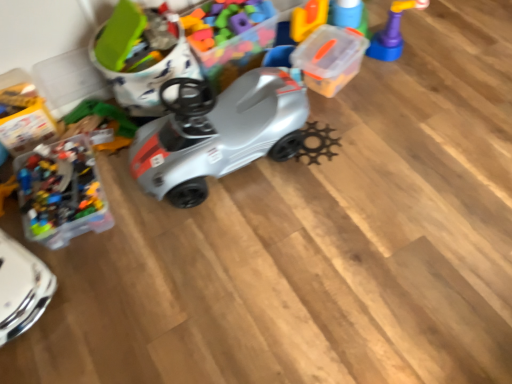
Question: Is rubberized plastic toy at upper right, placed as the 1th toy when sorted from right to left, outside transparent plastic container at upper right, the 2th toy viewed from the left?

Choices:
 (A) no
 (B) yes

Answer: (B)

Question: Would you say transparent plastic container at upper right, the 2th toy viewed from the left, is part of rubberized plastic toy at upper right, placed as the 1th toy when sorted from right to left,'s contents?

Choices:
 (A) yes
 (B) no

Answer: (B)

Question: Is transparent plastic container at upper right, the second toy when ordered from right to left, at the back of rubberized plastic toy at upper right, placed as the 1th toy when sorted from right to left?

Choices:
 (A) yes
 (B) no

Answer: (B)

Question: From a real-world perspective, is rubberized plastic toy at upper right, acting as the 3th toy starting from the left, under transparent plastic container at upper right, the second toy when ordered from right to left?

Choices:
 (A) yes
 (B) no

Answer: (B)

Question: Is there a large distance between rubberized plastic toy at upper right, placed as the 1th toy when sorted from right to left, and transparent plastic container at upper right, the second toy when ordered from right to left?

Choices:
 (A) yes
 (B) no

Answer: (B)

Question: Do you think matte plastic toy car at upper left, which is counted as the 1th toy, starting from the left, is within rubberized plastic toy at upper right, placed as the 1th toy when sorted from right to left, or outside of it?

Choices:
 (A) inside
 (B) outside

Answer: (B)

Question: Looking at the image, does matte plastic toy car at upper left, which is counted as the 1th toy, starting from the left, seem bigger or smaller compared to rubberized plastic toy at upper right, acting as the 3th toy starting from the left?

Choices:
 (A) small
 (B) big

Answer: (B)

Question: From the image's perspective, relative to rubberized plastic toy at upper right, acting as the 3th toy starting from the left, is matte plastic toy car at upper left, which is counted as the 1th toy, starting from the left, above or below?

Choices:
 (A) below
 (B) above

Answer: (A)

Question: In the image, is matte plastic toy car at upper left, which is counted as the 1th toy, starting from the left, positioned in front of or behind rubberized plastic toy at upper right, placed as the 1th toy when sorted from right to left?

Choices:
 (A) front
 (B) behind

Answer: (A)

Question: From the image's perspective, is transparent plastic container at upper right, the 2th toy viewed from the left, located above or below matte plastic toy car at upper left, placed as the third toy when sorted from right to left?

Choices:
 (A) above
 (B) below

Answer: (A)

Question: Which is correct: transparent plastic container at upper right, the 2th toy viewed from the left, is inside matte plastic toy car at upper left, which is counted as the 1th toy, starting from the left, or outside of it?

Choices:
 (A) inside
 (B) outside

Answer: (B)

Question: From a real-world perspective, is transparent plastic container at upper right, the 2th toy viewed from the left, above or below matte plastic toy car at upper left, placed as the third toy when sorted from right to left?

Choices:
 (A) above
 (B) below

Answer: (B)

Question: Is transparent plastic container at upper right, the 2th toy viewed from the left, in front of or behind matte plastic toy car at upper left, which is counted as the 1th toy, starting from the left, in the image?

Choices:
 (A) front
 (B) behind

Answer: (B)

Question: Relative to transparent plastic container at upper right, the second toy when ordered from right to left, is matte plastic toy car at upper left, which is counted as the 1th toy, starting from the left, in front or behind?

Choices:
 (A) behind
 (B) front

Answer: (B)

Question: From a real-world perspective, is matte plastic toy car at upper left, which is counted as the 1th toy, starting from the left, above or below transparent plastic container at upper right, the second toy when ordered from right to left?

Choices:
 (A) below
 (B) above

Answer: (B)